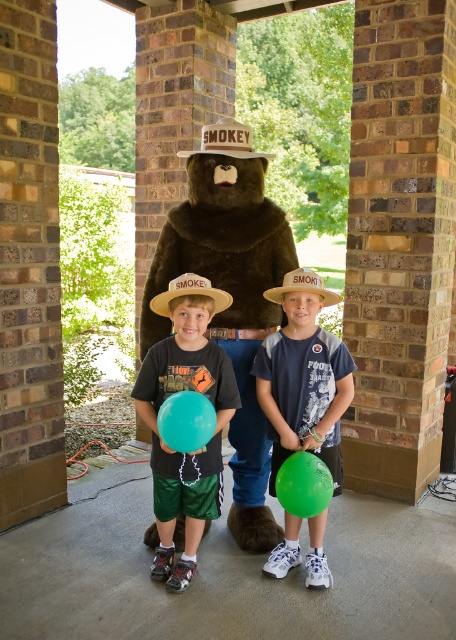
Question: Estimate the real-world distances between objects in this image. Which object is closer to the brown straw hat at center?

Choices:
 (A) brown furry bear at center
 (B) green rubber balloon at center

Answer: (A)

Question: Is green rubber balloon at center further to camera compared to teal rubber balloon at center?

Choices:
 (A) yes
 (B) no

Answer: (A)

Question: Is matte black balloon at center above teal rubber balloon at center?

Choices:
 (A) yes
 (B) no

Answer: (B)

Question: Which point appears farthest from the camera in this image?

Choices:
 (A) (258, 413)
 (B) (264, 564)

Answer: (A)

Question: Which point is closer to the camera?

Choices:
 (A) green rubber balloon at center
 (B) green matte balloon at center

Answer: (A)

Question: Can you confirm if matte black balloon at center is positioned to the right of green rubber balloon at center?

Choices:
 (A) no
 (B) yes

Answer: (A)